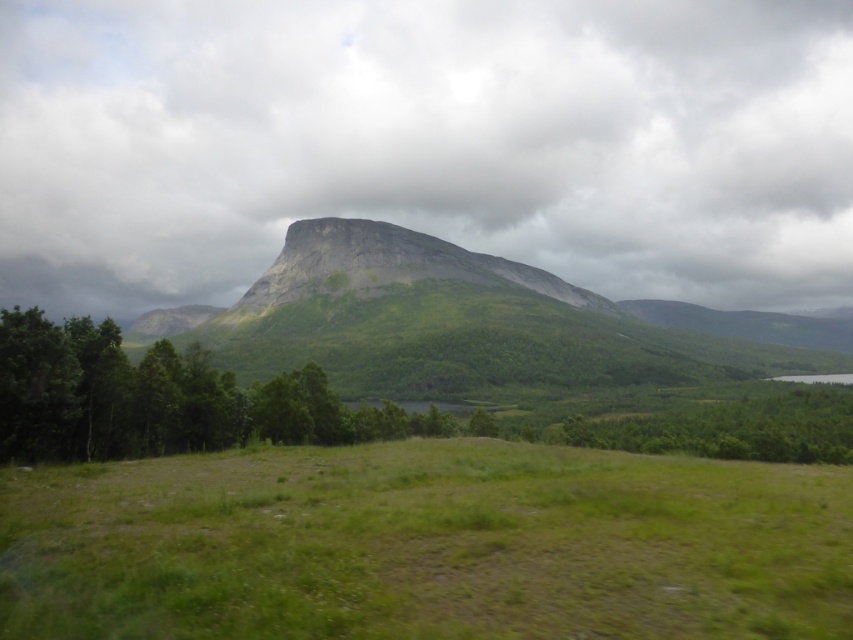
Question: Which of the following is the closest to the observer?

Choices:
 (A) green grassy mountain at center
 (B) green leafy tree at center
 (C) cloudy gray rock at upper center
 (D) green grassy field at center

Answer: (D)

Question: Is green grassy field at center to the left of green leafy tree at center from the viewer's perspective?

Choices:
 (A) yes
 (B) no

Answer: (A)

Question: Based on their relative distances, which object is nearer to the green grassy mountain at center?

Choices:
 (A) green leafy tree at center
 (B) green grassy field at center
 (C) green rock mountain at center

Answer: (C)

Question: Is green leafy tree at center wider than green rock mountain at center?

Choices:
 (A) yes
 (B) no

Answer: (B)

Question: Estimate the real-world distances between objects in this image. Which object is farther from the green rock mountain at center?

Choices:
 (A) cloudy gray rock at upper center
 (B) green leafy tree at center

Answer: (A)

Question: Does green grassy field at center have a lesser width compared to green rock mountain at center?

Choices:
 (A) no
 (B) yes

Answer: (B)